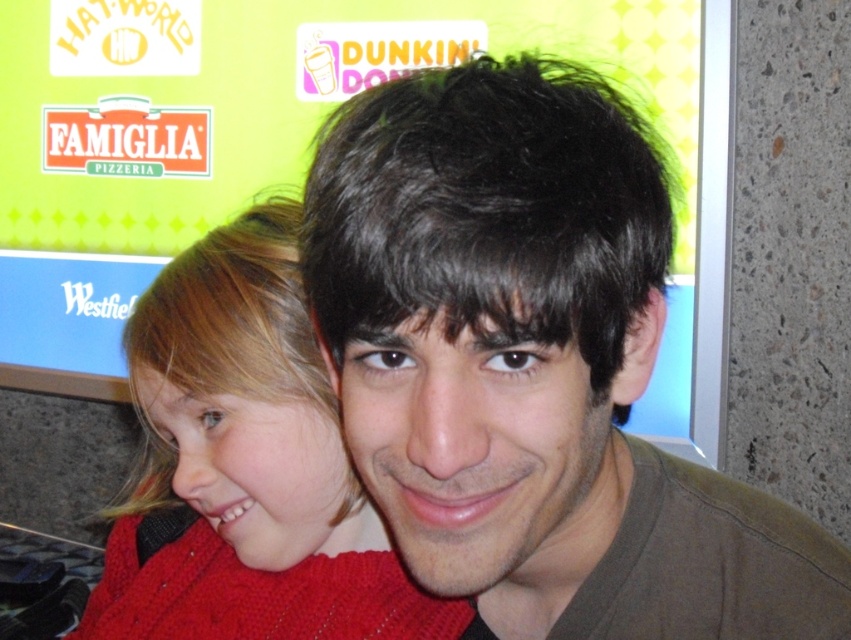
Who is higher up, knitted sweater at left or black matte hair at center?

black matte hair at center is higher up.

Does knitted sweater at left have a smaller size compared to black matte hair at center?

Incorrect, knitted sweater at left is not smaller in size than black matte hair at center.

Locate an element on the screen. Image resolution: width=851 pixels, height=640 pixels. knitted sweater at left is located at coordinates (244, 467).

Image resolution: width=851 pixels, height=640 pixels. In order to click on knitted sweater at left in this screenshot , I will do `click(244, 467)`.

Can you confirm if brown matte hair at center is wider than knitted sweater at left?

No.

This screenshot has width=851, height=640. Describe the element at coordinates (532, 368) in the screenshot. I see `brown matte hair at center` at that location.

Find the location of a particular element. This screenshot has height=640, width=851. brown matte hair at center is located at coordinates (532, 368).

Can you confirm if brown matte hair at center is positioned to the right of black matte hair at center?

Yes, brown matte hair at center is to the right of black matte hair at center.

Between brown matte hair at center and black matte hair at center, which one appears on the right side from the viewer's perspective?

Positioned to the right is brown matte hair at center.

Who is more forward, (398,108) or (604,84)?

Positioned in front is point (398,108).

Where is `brown matte hair at center`? brown matte hair at center is located at coordinates (532, 368).